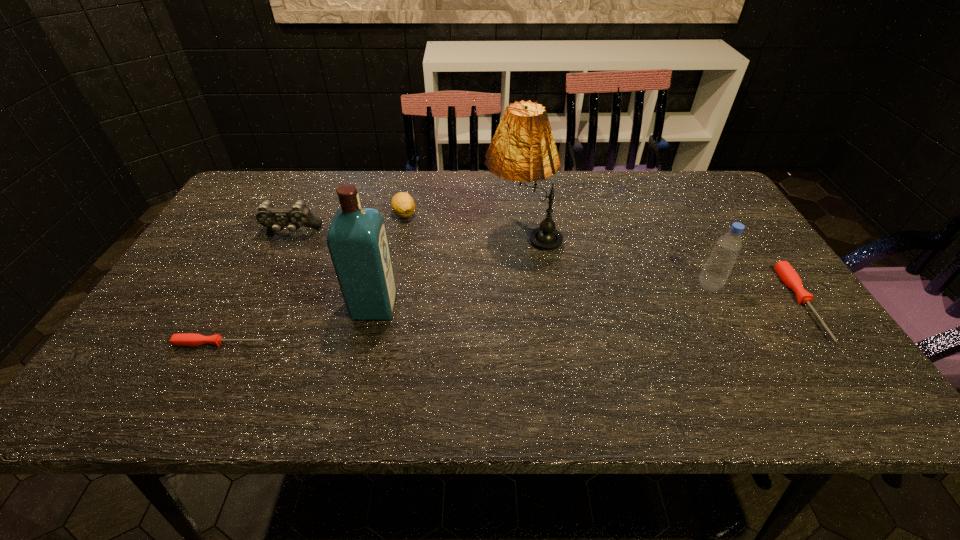
Image resolution: width=960 pixels, height=540 pixels. Identify the location of screwdriver at the left edge. (184, 339).

Image resolution: width=960 pixels, height=540 pixels. I want to click on control located in the left edge section of the desktop, so click(x=299, y=215).

Image resolution: width=960 pixels, height=540 pixels. Find the location of `object that is at the right edge`. object that is at the right edge is located at coordinates (785, 271).

Find the location of a particular element. object that is at the near left corner is located at coordinates (184, 339).

I want to click on object that is at the near right corner, so pos(785,271).

Locate an element on the screen. vacant area at the far edge of the desktop is located at coordinates (448, 209).

In the image, there is a desktop. What are the coordinates of `vacant region at the near edge` in the screenshot? It's located at (357, 335).

The height and width of the screenshot is (540, 960). In order to click on vacant space at the left edge of the desktop in this screenshot , I will do `click(161, 322)`.

I want to click on free point at the right edge, so click(753, 245).

Locate an element on the screen. vacant space at the far right corner of the desktop is located at coordinates (708, 175).